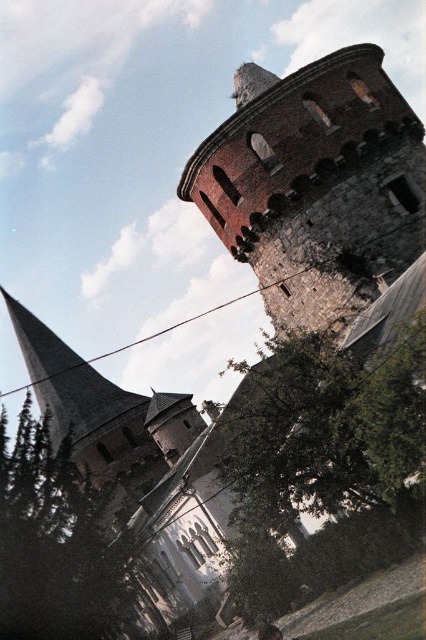
Between rustic stone spire at upper right and green leafy tree at center, which one appears on the right side from the viewer's perspective?

Positioned to the right is rustic stone spire at upper right.

Does rustic stone spire at upper right lie behind green leafy tree at center?

Yes, rustic stone spire at upper right is further from the viewer.

Does point (215, 173) come farther from viewer compared to point (299, 401)?

Yes, point (215, 173) is farther from viewer.

Where is `rustic stone spire at upper right`? The width and height of the screenshot is (426, 640). rustic stone spire at upper right is located at coordinates (316, 184).

In order to click on green leafy tree at center in this screenshot , I will do `click(322, 467)`.

Can you confirm if green leafy tree at center is positioned below green textured tree at lower left?

A: Actually, green leafy tree at center is above green textured tree at lower left.

Which is in front, point (259, 515) or point (100, 602)?

Point (259, 515) is in front.

In order to click on green leafy tree at center in this screenshot , I will do `click(322, 467)`.

Between point (417, 161) and point (80, 548), which one is positioned behind?

Point (417, 161)

Where is `rustic stone spire at upper right`? This screenshot has width=426, height=640. rustic stone spire at upper right is located at coordinates (316, 184).